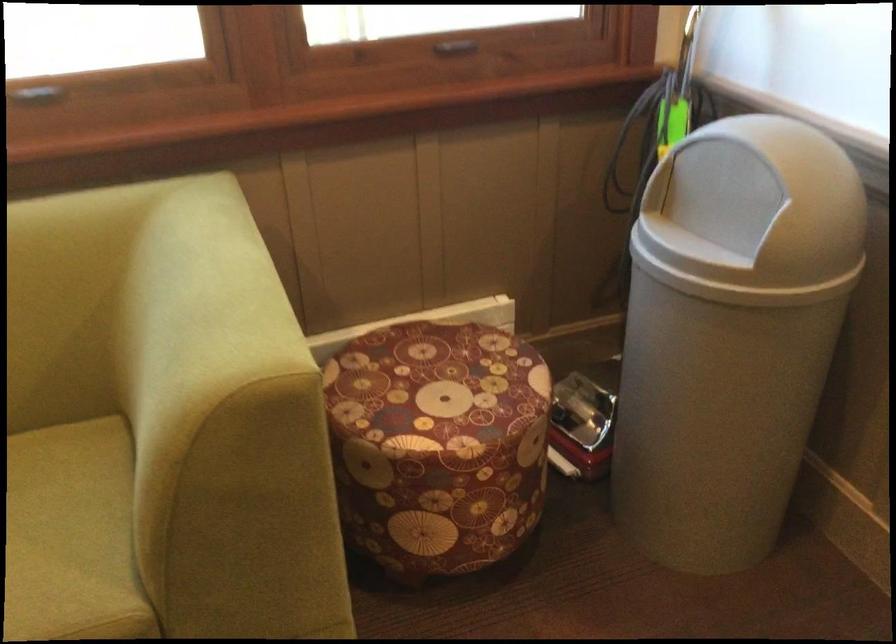
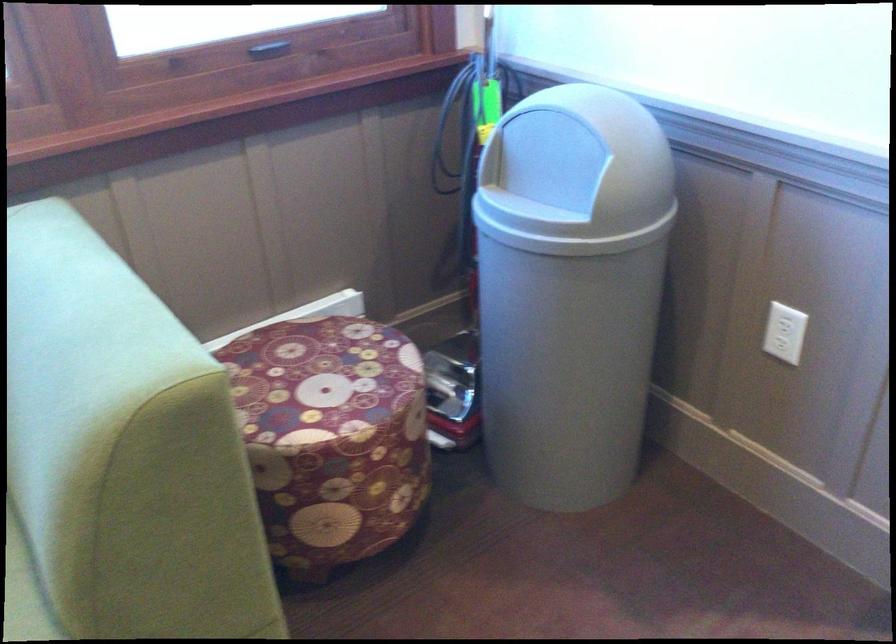
The point at (444, 379) is marked in the first image. Where is the corresponding point in the second image?

(320, 373)